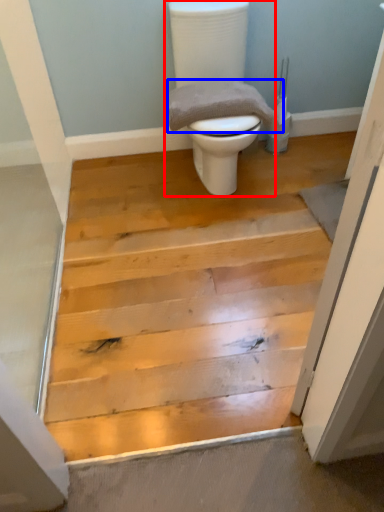
Question: Which object is further to the camera taking this photo, toilet (highlighted by a red box) or material (highlighted by a blue box)?

Choices:
 (A) toilet
 (B) material

Answer: (B)